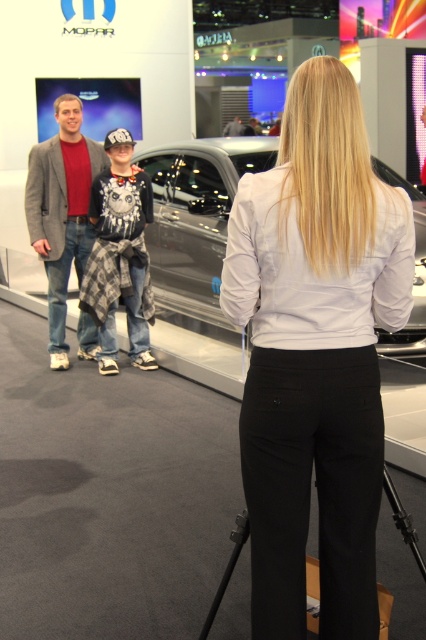
Who is positioned more to the left, white smooth shirt at center or black matte tripod at lower center?

white smooth shirt at center

Can you confirm if white smooth shirt at center is wider than black matte tripod at lower center?

Correct, the width of white smooth shirt at center exceeds that of black matte tripod at lower center.

What do you see at coordinates (316, 353) in the screenshot? The image size is (426, 640). I see `white smooth shirt at center` at bounding box center [316, 353].

This screenshot has height=640, width=426. In order to click on white smooth shirt at center in this screenshot , I will do `click(316, 353)`.

Between point (46, 204) and point (236, 120), which one is positioned behind?

The point (236, 120) is more distant.

Does point (80, 269) lie in front of point (236, 120)?

That is True.

I want to click on gray wool blazer at left, so click(x=62, y=211).

Is black matte tripod at lower center positioned in front of dark gray suit at center?

Yes, black matte tripod at lower center is in front of dark gray suit at center.

Where is `black matte tripod at lower center`? This screenshot has width=426, height=640. black matte tripod at lower center is located at coordinates (227, 568).

Locate an element on the screen. black matte tripod at lower center is located at coordinates (227, 568).